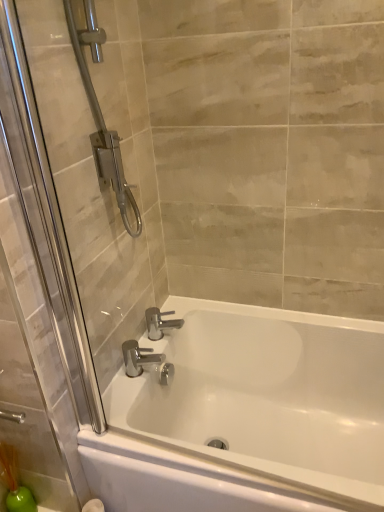
Question: Does chrome metallic faucet at center, arranged as the second tap when viewed from the front, have a greater width compared to white glossy bathtub at center?

Choices:
 (A) yes
 (B) no

Answer: (B)

Question: Does chrome metallic faucet at center, placed as the first tap when sorted from back to front, have a lesser height compared to white glossy bathtub at center?

Choices:
 (A) no
 (B) yes

Answer: (B)

Question: Is chrome metallic faucet at center, arranged as the second tap when viewed from the front, at the left side of white glossy bathtub at center?

Choices:
 (A) no
 (B) yes

Answer: (B)

Question: Are chrome metallic faucet at center, arranged as the second tap when viewed from the front, and white glossy bathtub at center far apart?

Choices:
 (A) yes
 (B) no

Answer: (B)

Question: From the image's perspective, would you say chrome metallic faucet at center, placed as the first tap when sorted from back to front, is positioned over white glossy bathtub at center?

Choices:
 (A) yes
 (B) no

Answer: (A)

Question: From a real-world perspective, is white glossy bathtub at center physically located above or below polished chrome faucet at lower center, which appears as the 1th tap when viewed from the front?

Choices:
 (A) below
 (B) above

Answer: (A)

Question: From the image's perspective, relative to polished chrome faucet at lower center, the second tap from the back, is white glossy bathtub at center above or below?

Choices:
 (A) above
 (B) below

Answer: (B)

Question: Do you think white glossy bathtub at center is within polished chrome faucet at lower center, which appears as the 1th tap when viewed from the front, or outside of it?

Choices:
 (A) inside
 (B) outside

Answer: (B)

Question: Considering the relative positions of white glossy bathtub at center and polished chrome faucet at lower center, the second tap from the back, in the image provided, is white glossy bathtub at center to the left or to the right of polished chrome faucet at lower center, the second tap from the back,?

Choices:
 (A) left
 (B) right

Answer: (B)

Question: Is point (135, 373) closer or farther from the camera than point (147, 318)?

Choices:
 (A) farther
 (B) closer

Answer: (B)

Question: Is polished chrome faucet at lower center, the second tap from the back, situated inside chrome metallic faucet at center, placed as the first tap when sorted from back to front, or outside?

Choices:
 (A) inside
 (B) outside

Answer: (B)

Question: From the image's perspective, is polished chrome faucet at lower center, the second tap from the back, located above or below chrome metallic faucet at center, placed as the first tap when sorted from back to front?

Choices:
 (A) above
 (B) below

Answer: (B)

Question: In the image, is polished chrome faucet at lower center, which appears as the 1th tap when viewed from the front, on the left side or the right side of chrome metallic faucet at center, placed as the first tap when sorted from back to front?

Choices:
 (A) right
 (B) left

Answer: (B)

Question: From a real-world perspective, relative to white glossy bathtub at center, is polished chrome faucet at lower center, the second tap from the back, vertically above or below?

Choices:
 (A) below
 (B) above

Answer: (B)

Question: From their relative heights in the image, would you say polished chrome faucet at lower center, the second tap from the back, is taller or shorter than white glossy bathtub at center?

Choices:
 (A) tall
 (B) short

Answer: (B)